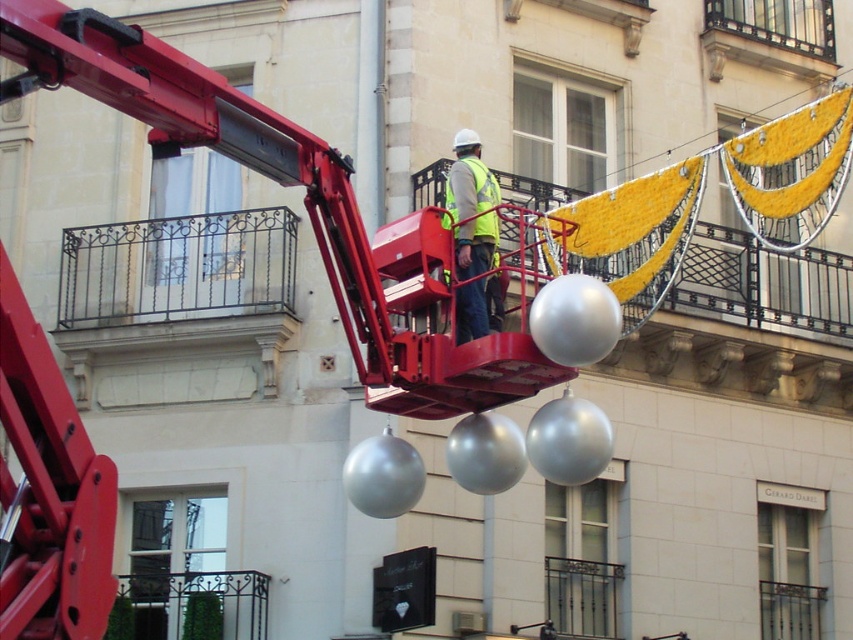
You are a delivery person trying to deliver a package to the address on the signboard. You notice a wrought iron balcony at upper left and a reflective silver vest at center. Which object is narrower in width?

The wrought iron balcony at upper left has a lesser width compared to the reflective silver vest at center, so the wrought iron balcony at upper left is narrower in width.

You are a delivery person trying to reach the signboard on the building. You see a wrought iron balcony at upper left and a reflective silver vest at center. Which object is closer to the signboard?

The wrought iron balcony at upper left is located below reflective silver vest at center, so the reflective silver vest at center is closer to the signboard.